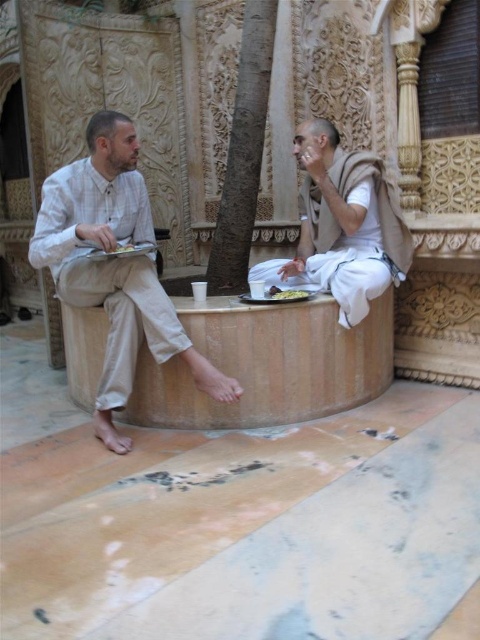
Who is higher up, light beige cotton pants at left or brown textured tree at center?

brown textured tree at center

Is point (105, 129) positioned after point (243, 164)?

No, it is not.

Is point (208, 388) farther from viewer compared to point (240, 220)?

No, (208, 388) is closer to viewer.

In order to click on light beige cotton pants at left in this screenshot , I will do `click(113, 266)`.

Does light beige cotton pants at left have a greater height compared to white matte cup at center?

Correct, light beige cotton pants at left is much taller as white matte cup at center.

From the picture: Is light beige cotton pants at left positioned before white matte cup at center?

Yes, light beige cotton pants at left is closer to the viewer.

Identify the location of light beige cotton pants at left. (113, 266).

Find the location of a particular element. The image size is (480, 640). light beige cotton pants at left is located at coordinates (113, 266).

Between white cotton cloth at center and brown textured tree at center, which one is positioned lower?

white cotton cloth at center is below.

Who is positioned more to the right, white cotton cloth at center or brown textured tree at center?

white cotton cloth at center

Does point (303, 205) come in front of point (260, 8)?

No, (303, 205) is further to viewer.

Locate an element on the screen. white cotton cloth at center is located at coordinates (343, 225).